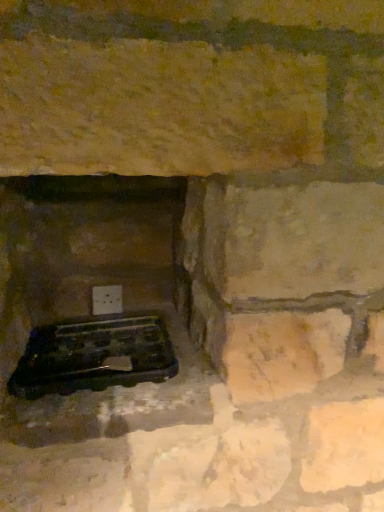
Question: From the image's perspective, is black plastic grill at lower left under white plastic electric outlet at lower center?

Choices:
 (A) no
 (B) yes

Answer: (B)

Question: From the image's perspective, is black plastic grill at lower left above white plastic electric outlet at lower center?

Choices:
 (A) yes
 (B) no

Answer: (B)

Question: Can you confirm if black plastic grill at lower left is wider than white plastic electric outlet at lower center?

Choices:
 (A) no
 (B) yes

Answer: (B)

Question: Is the depth of black plastic grill at lower left greater than that of white plastic electric outlet at lower center?

Choices:
 (A) yes
 (B) no

Answer: (B)

Question: Is black plastic grill at lower left looking in the opposite direction of white plastic electric outlet at lower center?

Choices:
 (A) no
 (B) yes

Answer: (B)

Question: Does black plastic grill at lower left lie in front of white plastic electric outlet at lower center?

Choices:
 (A) yes
 (B) no

Answer: (A)

Question: Can you confirm if white plastic electric outlet at lower center is positioned to the left of black plastic grill at lower left?

Choices:
 (A) no
 (B) yes

Answer: (B)

Question: Is white plastic electric outlet at lower center oriented away from black plastic grill at lower left?

Choices:
 (A) yes
 (B) no

Answer: (B)

Question: From the image's perspective, does white plastic electric outlet at lower center appear lower than black plastic grill at lower left?

Choices:
 (A) yes
 (B) no

Answer: (B)

Question: Is white plastic electric outlet at lower center shorter than black plastic grill at lower left?

Choices:
 (A) no
 (B) yes

Answer: (A)

Question: Does white plastic electric outlet at lower center have a lesser width compared to black plastic grill at lower left?

Choices:
 (A) no
 (B) yes

Answer: (B)

Question: Is the depth of white plastic electric outlet at lower center greater than that of black plastic grill at lower left?

Choices:
 (A) no
 (B) yes

Answer: (B)

Question: Does white plastic electric outlet at lower center come behind black plastic tray at lower left?

Choices:
 (A) yes
 (B) no

Answer: (A)